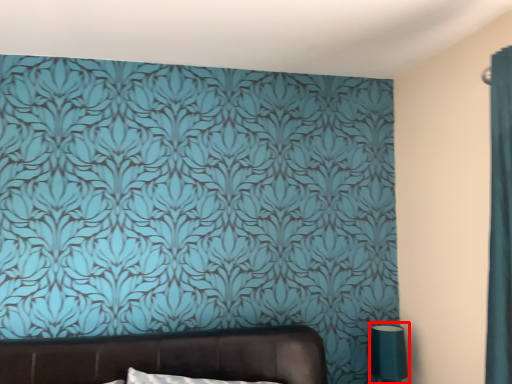
Question: From the image's perspective, where is table lamp (annotated by the red box) located relative to furniture?

Choices:
 (A) above
 (B) below

Answer: (B)